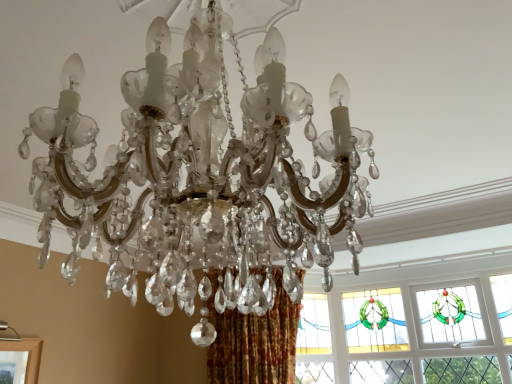
Question: Considering their positions, is clear crystal chandelier at center located in front of or behind stained glass window at upper right?

Choices:
 (A) front
 (B) behind

Answer: (A)

Question: From a real-world perspective, relative to stained glass window at upper right, is clear crystal chandelier at center vertically above or below?

Choices:
 (A) below
 (B) above

Answer: (B)

Question: Is point (266, 223) positioned closer to the camera than point (414, 279)?

Choices:
 (A) closer
 (B) farther

Answer: (A)

Question: Looking at the image, does stained glass window at upper right seem bigger or smaller compared to clear crystal chandelier at center?

Choices:
 (A) big
 (B) small

Answer: (B)

Question: In the image, is stained glass window at upper right positioned in front of or behind clear crystal chandelier at center?

Choices:
 (A) front
 (B) behind

Answer: (B)

Question: Looking at their shapes, would you say stained glass window at upper right is wider or thinner than clear crystal chandelier at center?

Choices:
 (A) wide
 (B) thin

Answer: (B)

Question: From their relative heights in the image, would you say stained glass window at upper right is taller or shorter than clear crystal chandelier at center?

Choices:
 (A) tall
 (B) short

Answer: (A)